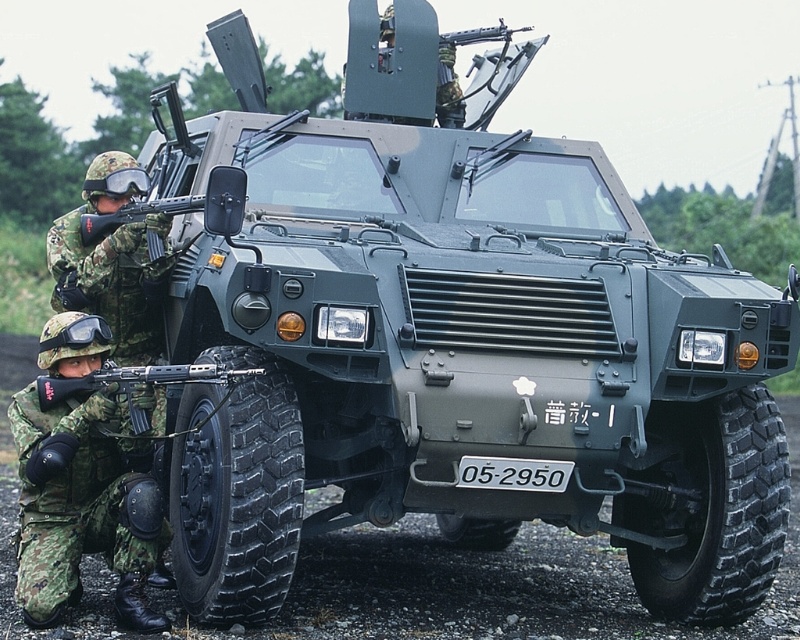
Question: Is black matte rifle at lower left further to the viewer compared to white plastic license plate at center?

Choices:
 (A) yes
 (B) no

Answer: (B)

Question: Among these objects, which one is farthest from the camera?

Choices:
 (A) white plastic license plate at center
 (B) black matte rifle at lower left

Answer: (A)

Question: Which object appears closest to the camera in this image?

Choices:
 (A) white plastic license plate at center
 (B) black matte rifle at lower left

Answer: (B)

Question: From the image, what is the correct spatial relationship of black matte rifle at lower left in relation to white plastic license plate at center?

Choices:
 (A) left
 (B) right

Answer: (A)

Question: Is black matte rifle at lower left to the left of white plastic license plate at center from the viewer's perspective?

Choices:
 (A) yes
 (B) no

Answer: (A)

Question: Which point is closer to the camera taking this photo?

Choices:
 (A) (206, 381)
 (B) (464, 472)

Answer: (A)